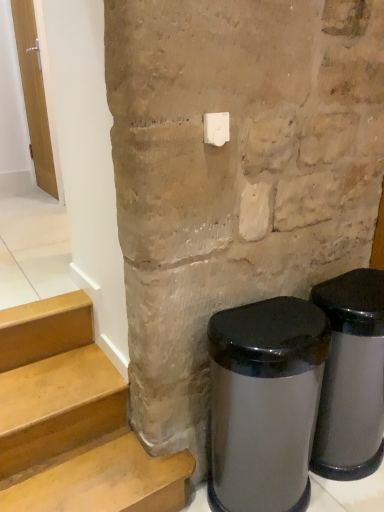
Question: Is white plastic light switch at upper center aimed at satin silver trash can at lower right, which is counted as the 1th waste container, starting from the left?

Choices:
 (A) no
 (B) yes

Answer: (A)

Question: Is the surface of white plastic light switch at upper center in direct contact with satin silver trash can at lower right, which is counted as the 1th waste container, starting from the left?

Choices:
 (A) yes
 (B) no

Answer: (B)

Question: From the image's perspective, is white plastic light switch at upper center on top of satin silver trash can at lower right, which is counted as the 1th waste container, starting from the left?

Choices:
 (A) yes
 (B) no

Answer: (A)

Question: Is white plastic light switch at upper center in front of satin silver trash can at lower right, which is counted as the 1th waste container, starting from the left?

Choices:
 (A) no
 (B) yes

Answer: (A)

Question: Does white plastic light switch at upper center have a greater width compared to satin silver trash can at lower right, which is counted as the 1th waste container, starting from the left?

Choices:
 (A) yes
 (B) no

Answer: (B)

Question: From the image's perspective, is white plastic light switch at upper center located above or below satin silver trash can at lower right, the second waste container from the left?

Choices:
 (A) above
 (B) below

Answer: (A)

Question: Is white plastic light switch at upper center inside the boundaries of satin silver trash can at lower right, the second waste container from the left, or outside?

Choices:
 (A) inside
 (B) outside

Answer: (B)

Question: Based on their sizes in the image, would you say white plastic light switch at upper center is bigger or smaller than satin silver trash can at lower right, which is the 1th waste container in right-to-left order?

Choices:
 (A) big
 (B) small

Answer: (B)

Question: Looking at their shapes, would you say white plastic light switch at upper center is wider or thinner than satin silver trash can at lower right, the second waste container from the left?

Choices:
 (A) wide
 (B) thin

Answer: (B)

Question: Considering their positions, is satin silver trash can at lower right, the second waste container from the left, located in front of or behind satin silver trash can at lower right, acting as the second waste container starting from the right?

Choices:
 (A) front
 (B) behind

Answer: (B)

Question: Considering the positions of satin silver trash can at lower right, the second waste container from the left, and satin silver trash can at lower right, which is counted as the 1th waste container, starting from the left, in the image, is satin silver trash can at lower right, the second waste container from the left, taller or shorter than satin silver trash can at lower right, which is counted as the 1th waste container, starting from the left,?

Choices:
 (A) short
 (B) tall

Answer: (A)

Question: In terms of width, does satin silver trash can at lower right, which is the 1th waste container in right-to-left order, look wider or thinner when compared to satin silver trash can at lower right, acting as the second waste container starting from the right?

Choices:
 (A) wide
 (B) thin

Answer: (B)

Question: Does point (342, 462) appear closer or farther from the camera than point (221, 390)?

Choices:
 (A) farther
 (B) closer

Answer: (A)

Question: Is satin silver trash can at lower right, acting as the second waste container starting from the right, wider or thinner than satin silver trash can at lower right, the second waste container from the left?

Choices:
 (A) wide
 (B) thin

Answer: (A)

Question: Considering the relative positions of satin silver trash can at lower right, which is counted as the 1th waste container, starting from the left, and satin silver trash can at lower right, which is the 1th waste container in right-to-left order, in the image provided, is satin silver trash can at lower right, which is counted as the 1th waste container, starting from the left, to the left or to the right of satin silver trash can at lower right, which is the 1th waste container in right-to-left order,?

Choices:
 (A) left
 (B) right

Answer: (A)